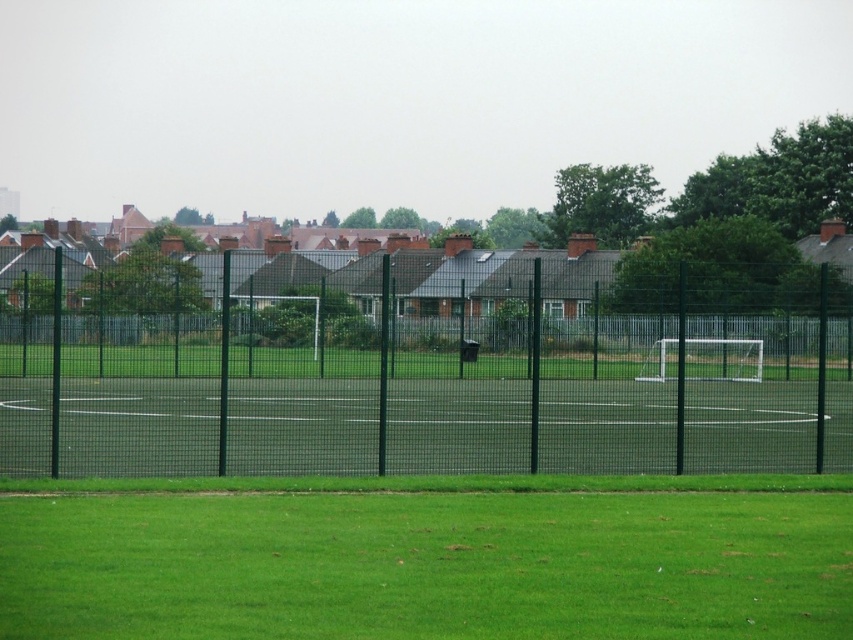
Between green mesh fence at center and green grass at lower center, which one appears on the left side from the viewer's perspective?

Positioned to the left is green grass at lower center.

Describe the element at coordinates (422, 365) in the screenshot. I see `green mesh fence at center` at that location.

This screenshot has height=640, width=853. Find the location of `green mesh fence at center`. green mesh fence at center is located at coordinates (422, 365).